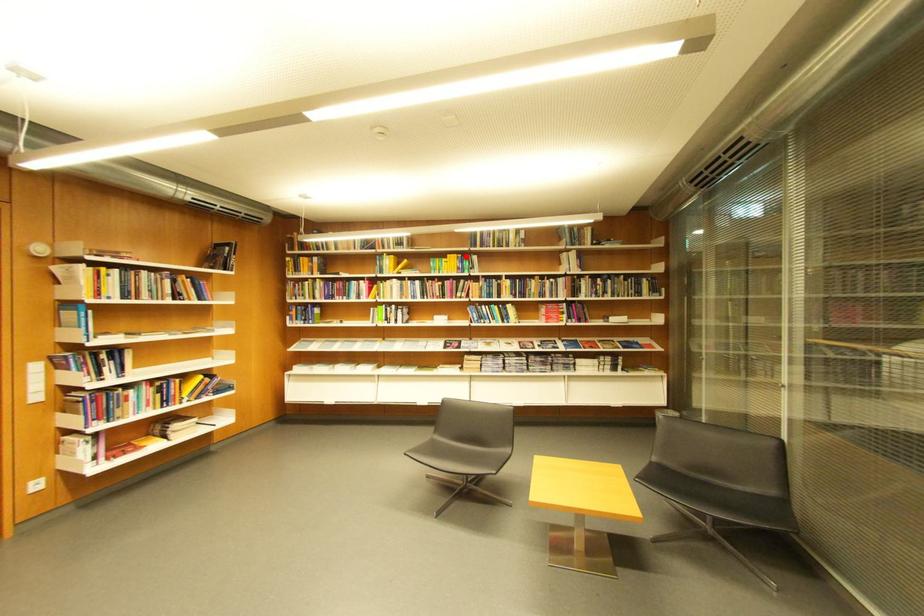
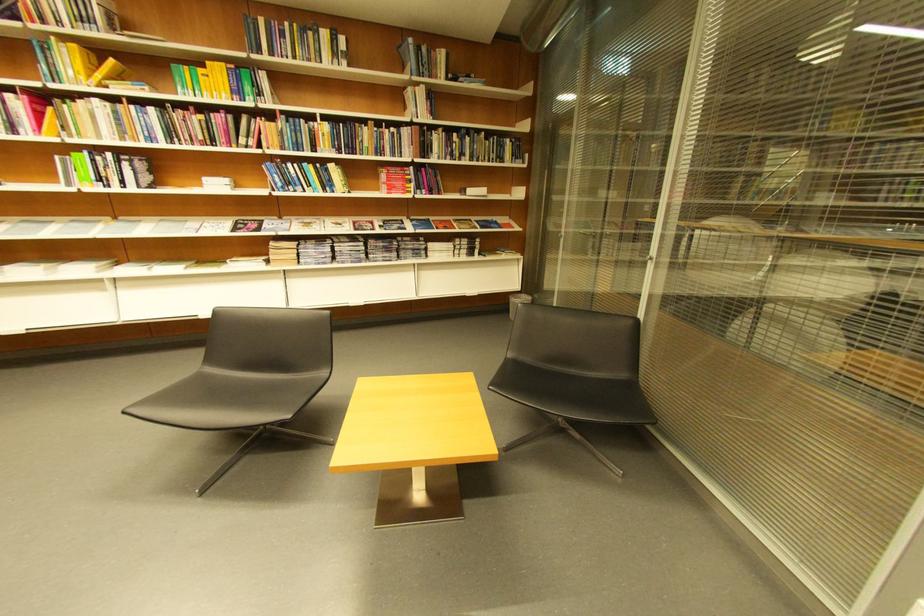
The point at the highlighted location is marked in the first image. Where is the corresponding point in the second image?

(234, 66)